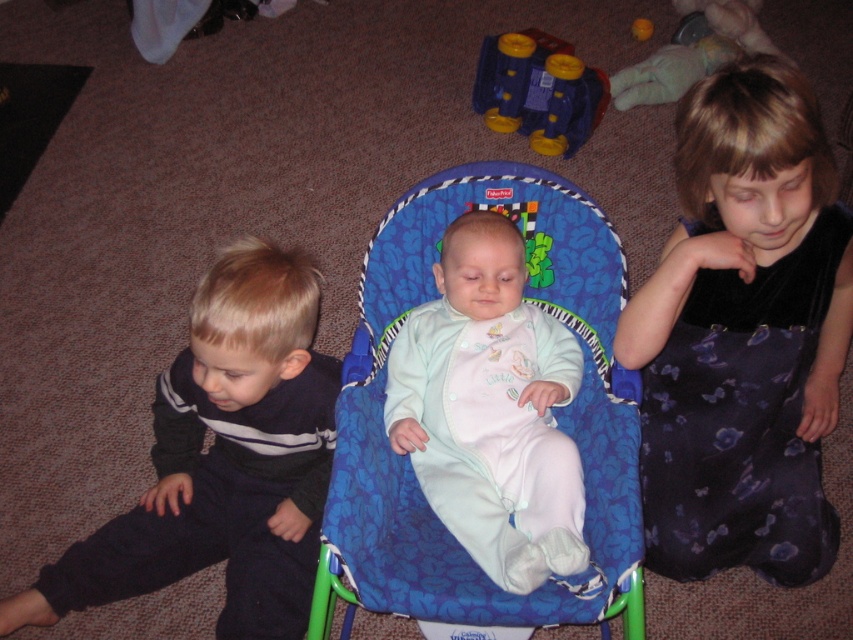
Question: Can you confirm if blue fabric baby chair at center is positioned to the right of blue plastic toy at upper center?

Choices:
 (A) no
 (B) yes

Answer: (A)

Question: Among these objects, which one is farthest from the camera?

Choices:
 (A) velvet black dress at right
 (B) dark blue fleece pants at left

Answer: (B)

Question: Considering the relative positions of light blue soft fabric baby at center and blue plastic toy at upper center in the image provided, where is light blue soft fabric baby at center located with respect to blue plastic toy at upper center?

Choices:
 (A) left
 (B) right

Answer: (A)

Question: Which object is positioned farthest from the blue fabric baby chair at center?

Choices:
 (A) velvet black dress at right
 (B) blue plastic toy at upper center
 (C) light blue soft fabric baby at center

Answer: (B)

Question: Can you confirm if dark blue fleece pants at left is bigger than light blue soft fabric baby at center?

Choices:
 (A) yes
 (B) no

Answer: (A)

Question: Which point appears farthest from the camera in this image?

Choices:
 (A) (735, 442)
 (B) (440, 214)
 (C) (486, 108)

Answer: (C)